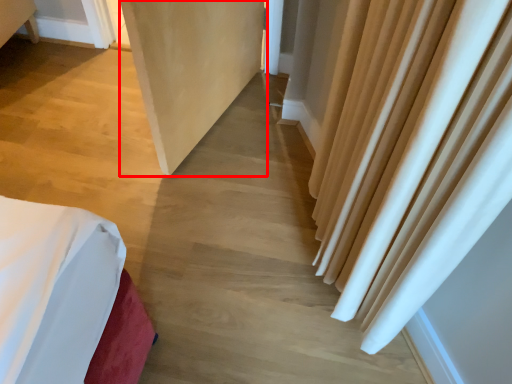
Question: Considering the relative positions of screen door (annotated by the red box) and curtain in the image provided, where is screen door (annotated by the red box) located with respect to the staircase?

Choices:
 (A) left
 (B) right

Answer: (A)